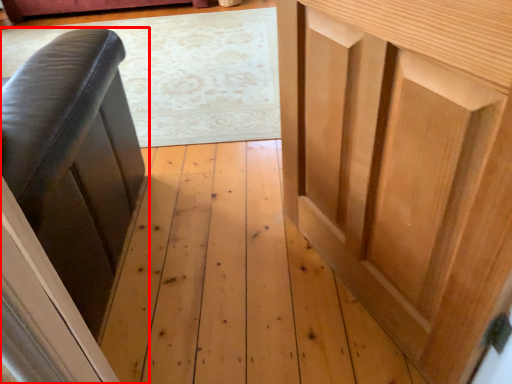
Question: Considering the relative positions of furniture (annotated by the red box) and cupboard in the image provided, where is furniture (annotated by the red box) located with respect to the staircase?

Choices:
 (A) right
 (B) left

Answer: (B)